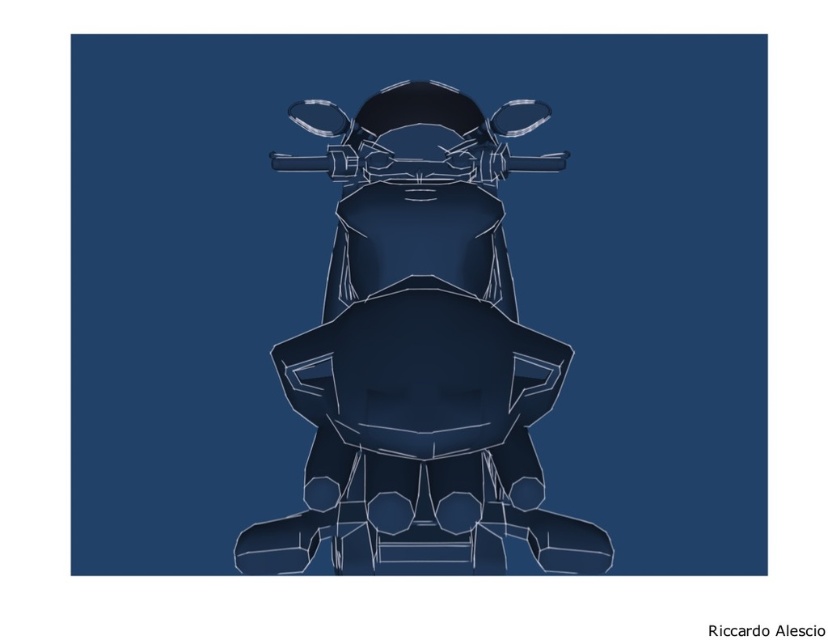
Is point (441, 232) behind point (538, 160)?

No, it is in front of (538, 160).

Image resolution: width=828 pixels, height=640 pixels. Find the location of `matte dark blue motorcycle at center`. matte dark blue motorcycle at center is located at coordinates (421, 356).